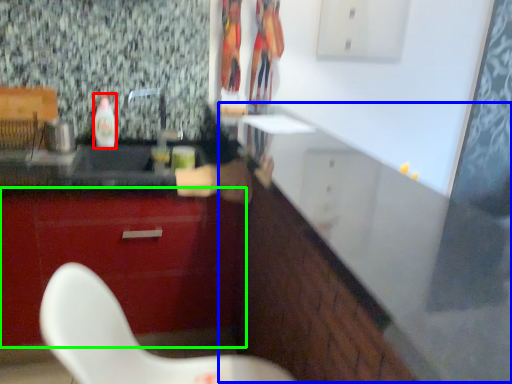
Question: Based on their relative distances, which object is farther from bottle (highlighted by a red box)? Choose from counter (highlighted by a blue box) and cabinetry (highlighted by a green box).

Choices:
 (A) counter
 (B) cabinetry

Answer: (A)